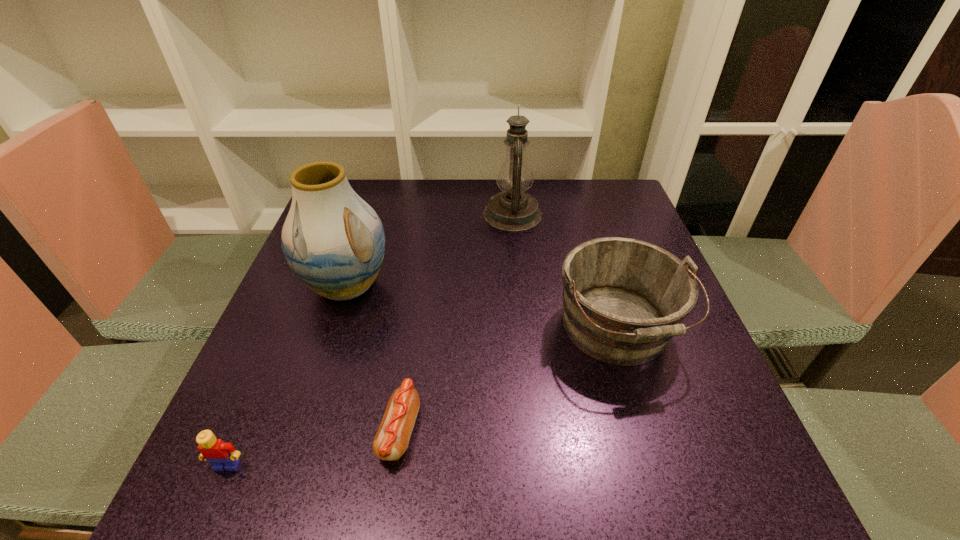
You are a GUI agent. You are given a task and a screenshot of the screen. Output one action in this format:
    pyautogui.click(x=<x>, y=<y>)
    Task: Click on the free spot located 0.350m on the right of the third object from left to right
    The width and height of the screenshot is (960, 540).
    Given the screenshot: What is the action you would take?
    pyautogui.click(x=630, y=430)

The height and width of the screenshot is (540, 960). Find the location of `object at the far edge`. object at the far edge is located at coordinates (513, 210).

Identify the location of Lego that is positioned at the near edge. This screenshot has height=540, width=960. (221, 455).

Identify the location of sausage positioned at the near edge. (391, 441).

What are the coordinates of `vase that is at the left edge` in the screenshot? It's located at (334, 242).

Locate an element on the screen. This screenshot has width=960, height=540. Lego at the left edge is located at coordinates (221, 455).

Locate an element on the screen. The image size is (960, 540). object located at the right edge is located at coordinates (624, 299).

This screenshot has width=960, height=540. What are the coordinates of `object that is at the near left corner` in the screenshot? It's located at (221, 455).

The image size is (960, 540). What are the coordinates of `free space at the far edge of the desktop` in the screenshot? It's located at (457, 210).

Where is `vacant space at the near edge of the desktop`? vacant space at the near edge of the desktop is located at coordinates (350, 488).